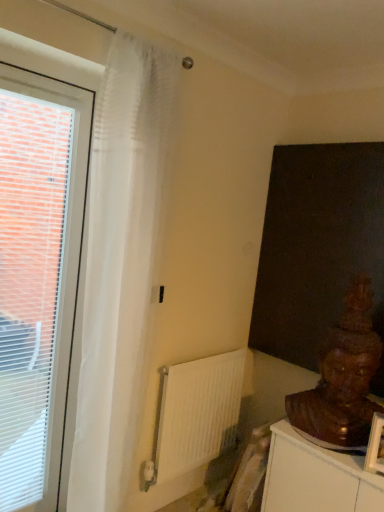
Question: Does point (100, 374) appear closer or farther from the camera than point (39, 263)?

Choices:
 (A) farther
 (B) closer

Answer: (B)

Question: In terms of width, does translucent white curtain at left look wider or thinner when compared to white plastic window at left?

Choices:
 (A) wide
 (B) thin

Answer: (A)

Question: Based on their relative distances, which object is nearer to the white matte radiator at center?

Choices:
 (A) translucent white curtain at left
 (B) white plastic window at left
 (C) brown wooden statue at lower right

Answer: (A)

Question: Estimate the real-world distances between objects in this image. Which object is closer to the white matte radiator at center?

Choices:
 (A) translucent white curtain at left
 (B) white plastic window at left
 (C) brown wooden statue at lower right

Answer: (A)